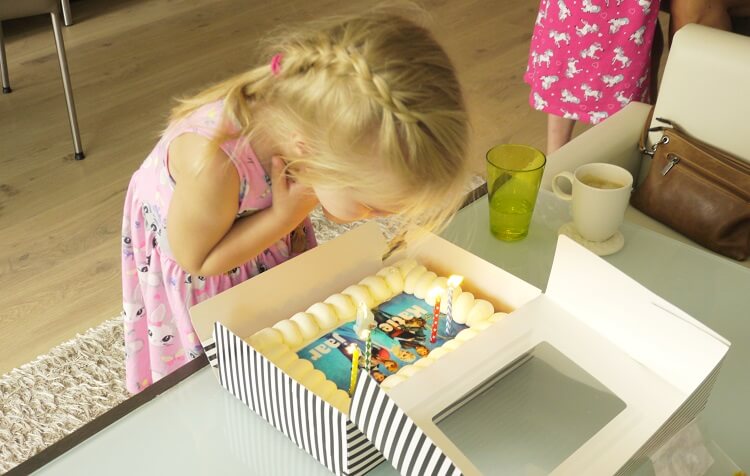
Identify the location of carpet. (58, 399).